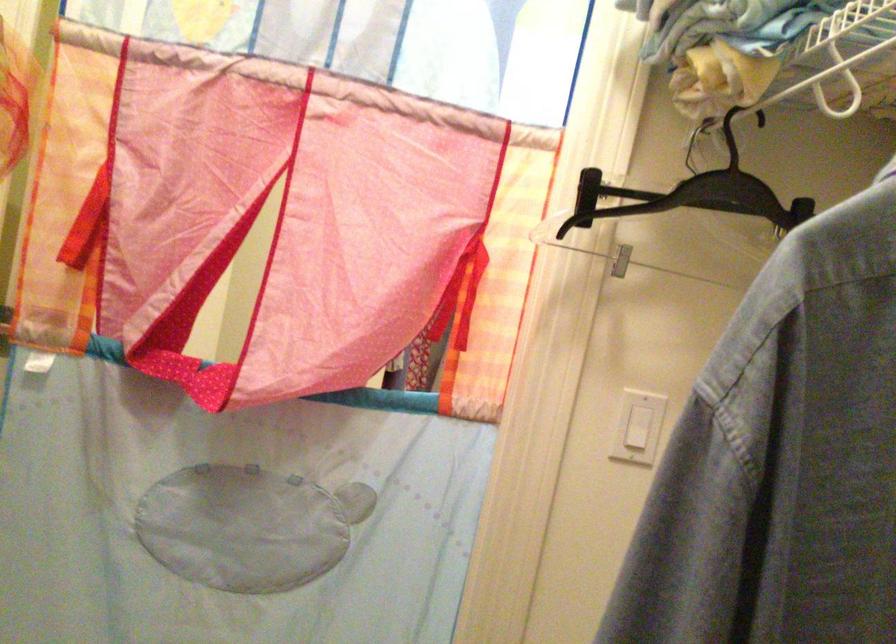
What do you see at coordinates (814, 86) in the screenshot?
I see `the white shelf rod` at bounding box center [814, 86].